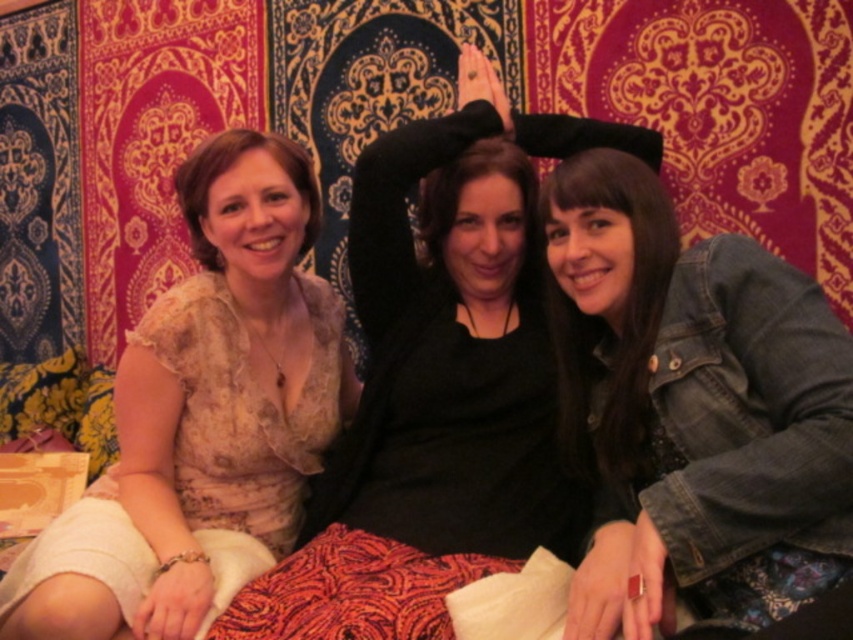
You are an AI analyzing the positioning of objects in the image. The scene has a person on the left, a person in the center, and a person on the right. Where is the denim jacket at center located in terms of its 2D coordinates?

The denim jacket at center is located at the 2D coordinates of point (689, 396).

You are organizing a clothing donation drive and need to determine if the denim jacket at center and the matte beige blouse at left can fit into a box that has a maximum capacity of 10 liters. Given their sizes, will both items fit comfortably without overcrowding the box?

The denim jacket at center is smaller than the matte beige blouse at left. However, without specific volume measurements for each item, it is impossible to definitively determine if both will fit into the 10 liter box. Additional information about their individual sizes is required to make an accurate assessment.